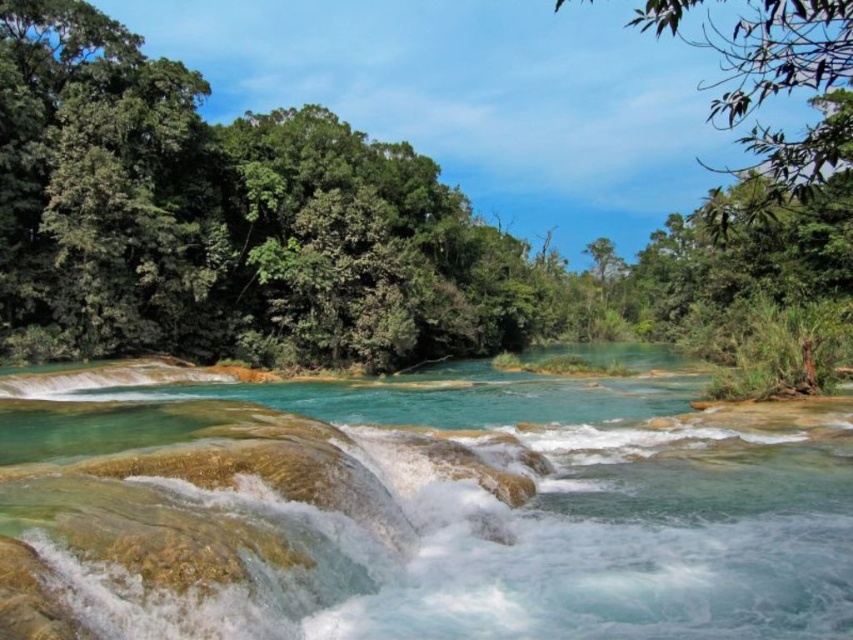
You are standing at the edge of the river and want to reach a specific point marked as point (x=250, y=508). Given that the river has areas with shallow water and rocks, can you safely walk to that point without getting your feet wet?

The distance between point (x=250, y=508) and the viewer is 10.36 meters. However, the scene description mentions the river has shallow areas with visible rocks and pebbles beneath the surface. Since the path to the point involves crossing the river, there might be sections where the water is shallow enough to walk through, but other parts may have deeper water creating white frothy waves. Without specific information about the exact path and depth variations, it is uncertain if you can safely reach the point

Consider the image. You are a hiker who wants to take a photo of both the green leafy tree at center and the green leafy tree at upper right in the same frame. Which tree should you stand closer to in order to include both in your photo?

You should stand closer to the green leafy tree at center because it is shorter than the green leafy tree at upper right, allowing you to capture both in the frame by adjusting your distance accordingly.

You are standing at the edge of the river and see two points marked in the scene. Which point is closer to you, point [712,221] or point [817,28]?

Point [712,221] is further to the camera than point [817,28], so the point closer to you is point [817,28].